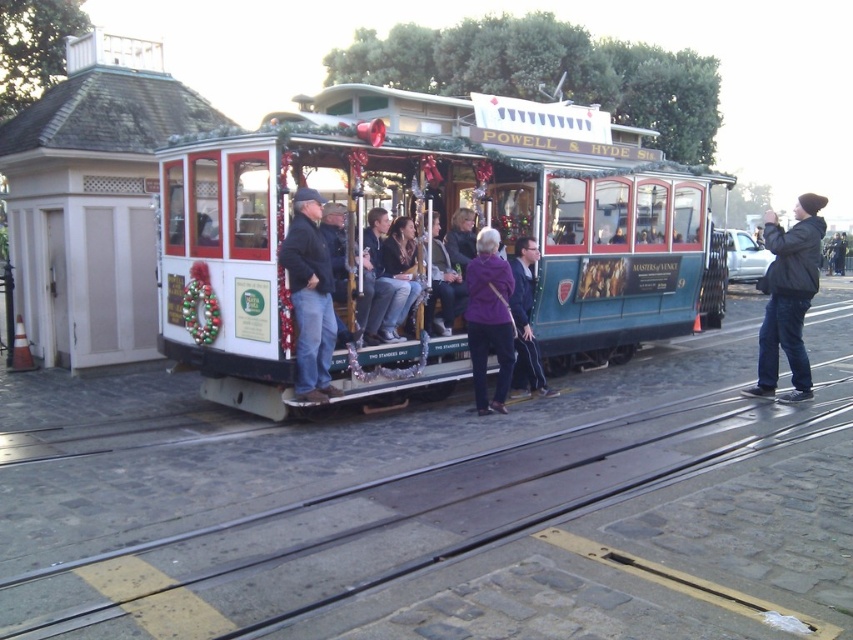
Who is higher up, metal train track at center or purple fabric coat at center?

Positioned higher is purple fabric coat at center.

Does metal train track at center have a greater width compared to purple fabric coat at center?

Correct, the width of metal train track at center exceeds that of purple fabric coat at center.

Is point (209, 579) farther from camera compared to point (479, 292)?

No, (209, 579) is in front of (479, 292).

Image resolution: width=853 pixels, height=640 pixels. What are the coordinates of `metal train track at center` in the screenshot? It's located at (440, 508).

At what (x,y) coordinates should I click in order to perform the action: click on black leather jacket at right. Please return your answer as a coordinate pair (x, y). Looking at the image, I should click on (788, 298).

Is point (781, 248) closer to camera compared to point (415, 253)?

Yes.

This screenshot has width=853, height=640. In order to click on black leather jacket at right in this screenshot , I will do `click(788, 298)`.

Does metal train track at center have a greater height compared to black leather jacket at right?

Incorrect, metal train track at center's height is not larger of black leather jacket at right's.

Can you confirm if metal train track at center is bigger than black leather jacket at right?

Actually, metal train track at center might be smaller than black leather jacket at right.

In order to click on metal train track at center in this screenshot , I will do `click(440, 508)`.